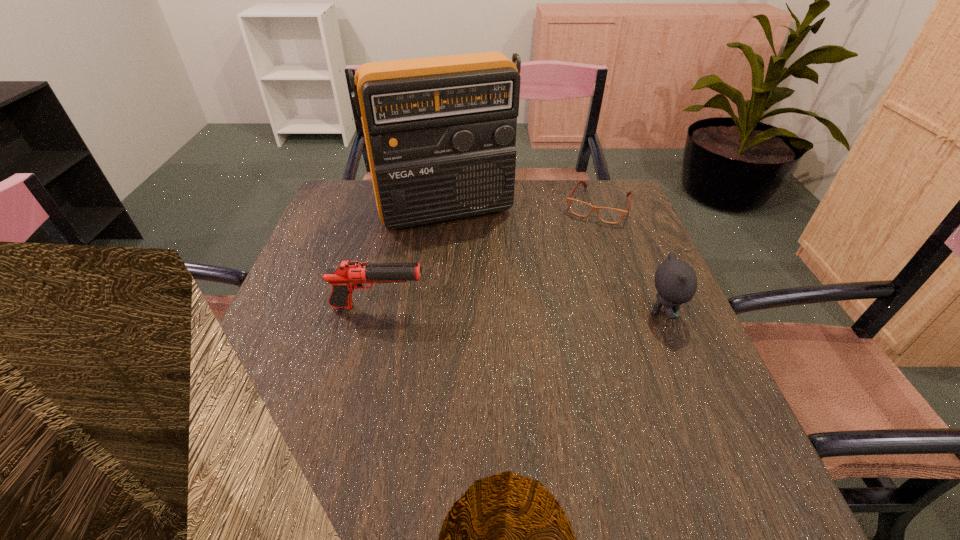
Locate an element on the screen. free space located on the front-facing side of the radio receiver is located at coordinates (487, 281).

Image resolution: width=960 pixels, height=540 pixels. In order to click on spectacles that is at the far edge in this screenshot , I will do (608, 215).

The height and width of the screenshot is (540, 960). In order to click on radio receiver at the far edge in this screenshot , I will do `click(440, 132)`.

Where is `gun at the left edge`? This screenshot has height=540, width=960. gun at the left edge is located at coordinates (348, 275).

This screenshot has height=540, width=960. I want to click on radio receiver positioned at the left edge, so click(440, 132).

The height and width of the screenshot is (540, 960). I want to click on kitten positioned at the right edge, so click(675, 280).

In order to click on spectacles that is at the right edge in this screenshot , I will do `click(608, 215)`.

Identify the location of object located at the far left corner. (440, 132).

At what (x,y) coordinates should I click in order to perform the action: click on object at the far right corner. Please return your answer as a coordinate pair (x, y). This screenshot has height=540, width=960. Looking at the image, I should click on (608, 215).

Image resolution: width=960 pixels, height=540 pixels. What are the coordinates of `free space at the near edge` in the screenshot? It's located at (444, 436).